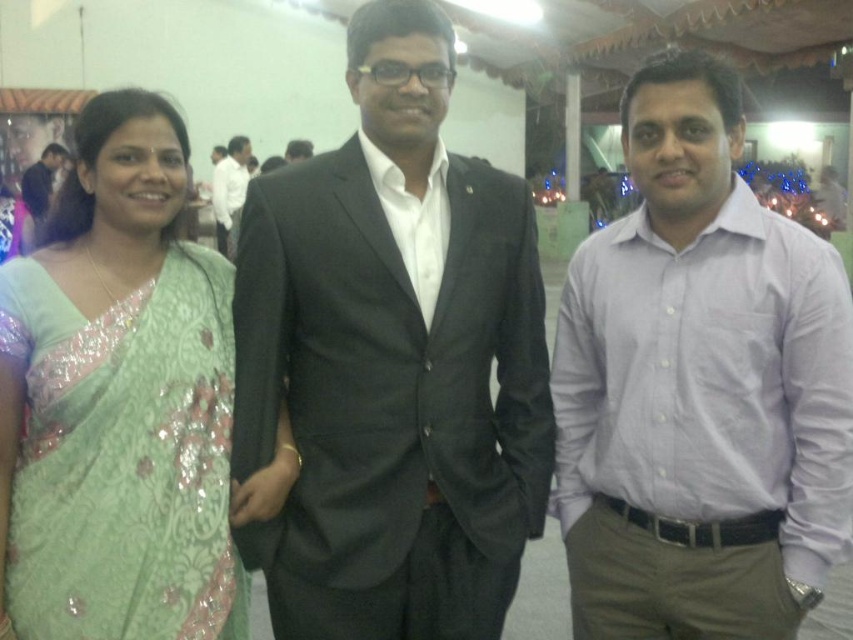
Between point (631, 522) and point (99, 403), which one is positioned behind?

Point (631, 522)

What are the coordinates of `light purple shirt at center` in the screenshot? It's located at (699, 387).

Can you confirm if black matte suit at center is thinner than matte black suit at center?

In fact, black matte suit at center might be wider than matte black suit at center.

Between point (282, 227) and point (291, 161), which one is positioned behind?

The point (291, 161) is behind.

Image resolution: width=853 pixels, height=640 pixels. Describe the element at coordinates (393, 362) in the screenshot. I see `black matte suit at center` at that location.

At what (x,y) coordinates should I click in order to perform the action: click on black matte suit at center. Please return your answer as a coordinate pair (x, y). The height and width of the screenshot is (640, 853). Looking at the image, I should click on (393, 362).

Identify the location of black matte suit at center. This screenshot has width=853, height=640. (393, 362).

What do you see at coordinates (393, 362) in the screenshot? This screenshot has height=640, width=853. I see `black matte suit at center` at bounding box center [393, 362].

Is point (393, 621) positioned after point (672, 637)?

No.

You are a GUI agent. You are given a task and a screenshot of the screen. Output one action in this format:
    pyautogui.click(x=<x>, y=<y>)
    Task: Click on the black matte suit at center
    
    Given the screenshot: What is the action you would take?
    pyautogui.click(x=393, y=362)